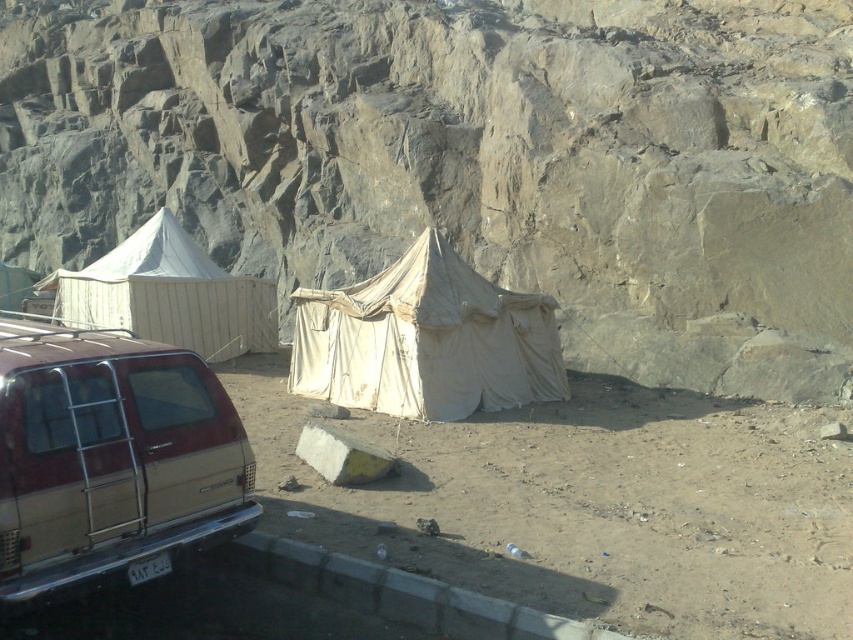
Looking at this image, is rough stone rock face at upper center taller than maroon beige minivan at lower left?

Correct, rough stone rock face at upper center is much taller as maroon beige minivan at lower left.

What do you see at coordinates (468, 157) in the screenshot? The height and width of the screenshot is (640, 853). I see `rough stone rock face at upper center` at bounding box center [468, 157].

Which is behind, point (593, 352) or point (137, 428)?

The point (593, 352) is behind.

The height and width of the screenshot is (640, 853). In order to click on rough stone rock face at upper center in this screenshot , I will do `click(468, 157)`.

Is maroon beige minivan at lower left bigger than white canvas tent at center?

Yes, maroon beige minivan at lower left is bigger than white canvas tent at center.

You are a GUI agent. You are given a task and a screenshot of the screen. Output one action in this format:
    pyautogui.click(x=<x>, y=<y>)
    Task: Click on the maroon beige minivan at lower left
    
    Given the screenshot: What is the action you would take?
    pyautogui.click(x=109, y=458)

Find the location of a particular element. This screenshot has width=853, height=640. maroon beige minivan at lower left is located at coordinates (109, 458).

Between point (467, 307) and point (213, 324), which one is positioned in front?

Point (467, 307) is more forward.

Who is positioned more to the left, beige canvas tent at center or white canvas tent at center?

white canvas tent at center is more to the left.

The height and width of the screenshot is (640, 853). In order to click on beige canvas tent at center in this screenshot , I will do `click(426, 340)`.